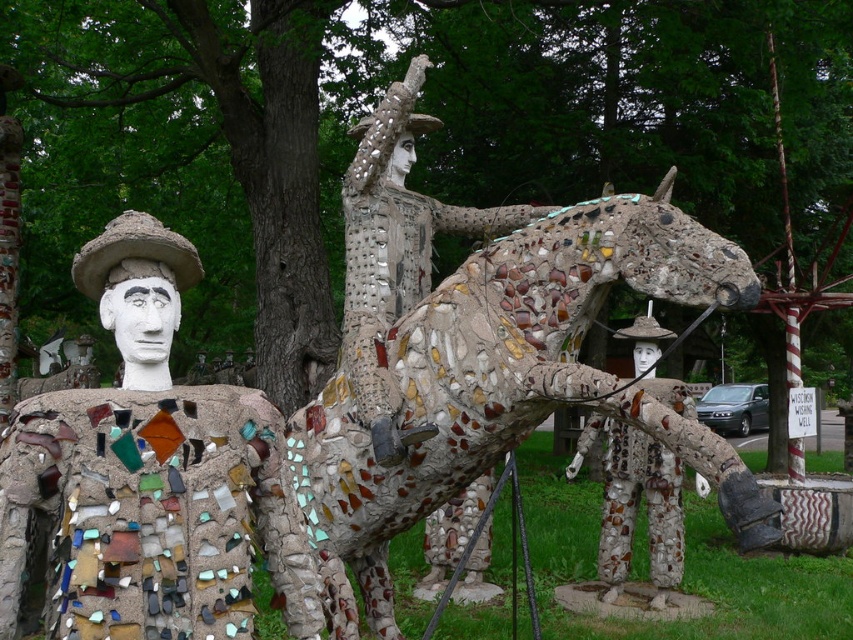
Between mosaic horse at center and mosaic man at left, which one is positioned lower?

mosaic horse at center is lower down.

How distant is mosaic horse at center from mosaic man at left?

30.07 inches

Image resolution: width=853 pixels, height=640 pixels. Find the location of `mosaic horse at center`. mosaic horse at center is located at coordinates (508, 384).

The width and height of the screenshot is (853, 640). I want to click on mosaic horse at center, so click(x=508, y=384).